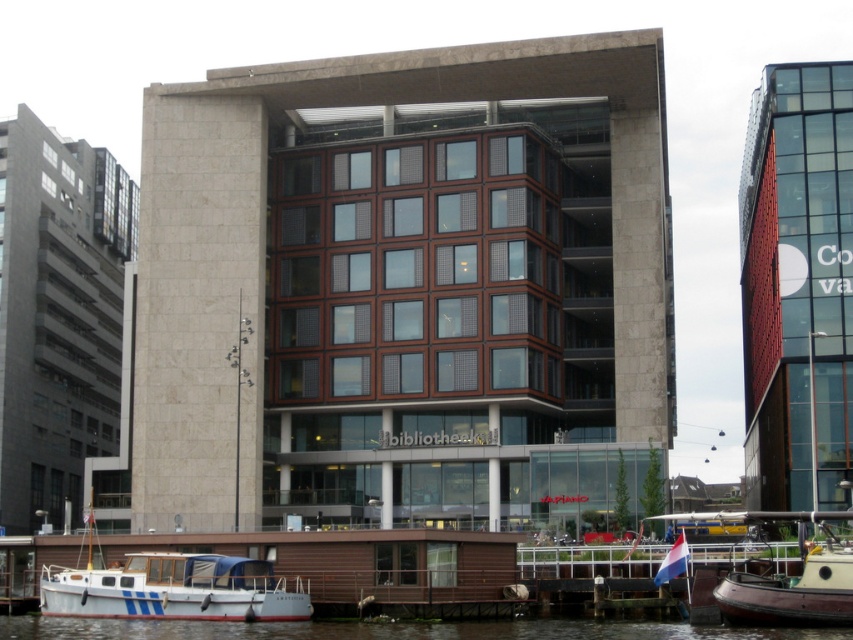
You are standing on the pier and want to board the white matte boat at lower left. Which direction should you walk to reach it from the smooth water at lower center?

The white matte boat at lower left is located above smooth water at lower center, so you should walk towards the lower left direction from the smooth water at lower center to reach the boat.

You are a tour guide explaining the waterfront area to visitors. You mention the white matte boat at lower left and the smooth water at lower center. How far apart are these two elements?

The white matte boat at lower left is 3.11 meters from the smooth water at lower center.